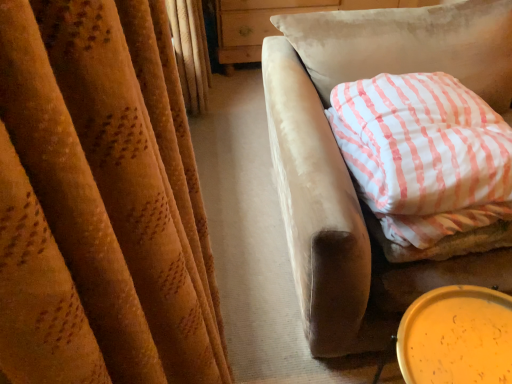
Question: Does yellow plastic lid at lower right have a larger size compared to white striped fabric pillow at right?

Choices:
 (A) yes
 (B) no

Answer: (B)

Question: Can you confirm if yellow plastic lid at lower right is wider than white striped fabric pillow at right?

Choices:
 (A) no
 (B) yes

Answer: (A)

Question: From a real-world perspective, does yellow plastic lid at lower right sit lower than white striped fabric pillow at right?

Choices:
 (A) no
 (B) yes

Answer: (B)

Question: Is yellow plastic lid at lower right positioned behind white striped fabric pillow at right?

Choices:
 (A) yes
 (B) no

Answer: (B)

Question: Does yellow plastic lid at lower right have a lesser width compared to white striped fabric pillow at right?

Choices:
 (A) yes
 (B) no

Answer: (A)

Question: Does yellow plastic lid at lower right appear on the right side of white striped fabric pillow at right?

Choices:
 (A) yes
 (B) no

Answer: (B)

Question: Is the position of white striped fabric pillow at right less distant than that of yellow plastic lid at lower right?

Choices:
 (A) no
 (B) yes

Answer: (A)

Question: From a real-world perspective, is white striped fabric pillow at right located higher than yellow plastic lid at lower right?

Choices:
 (A) no
 (B) yes

Answer: (B)

Question: Is yellow plastic lid at lower right located within white striped fabric pillow at right?

Choices:
 (A) no
 (B) yes

Answer: (A)

Question: Is the position of white striped fabric pillow at right more distant than that of yellow plastic lid at lower right?

Choices:
 (A) yes
 (B) no

Answer: (A)

Question: Does white striped fabric pillow at right appear on the right side of yellow plastic lid at lower right?

Choices:
 (A) no
 (B) yes

Answer: (B)

Question: Is white striped fabric pillow at right positioned with its back to yellow plastic lid at lower right?

Choices:
 (A) yes
 (B) no

Answer: (B)

Question: From a real-world perspective, relative to white striped fabric pillow at right, is yellow plastic lid at lower right vertically above or below?

Choices:
 (A) below
 (B) above

Answer: (A)